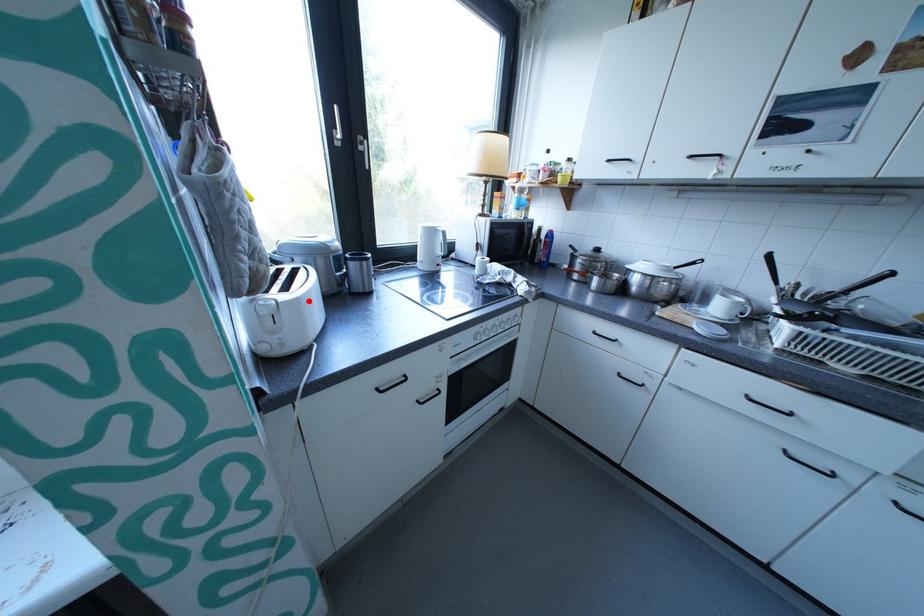
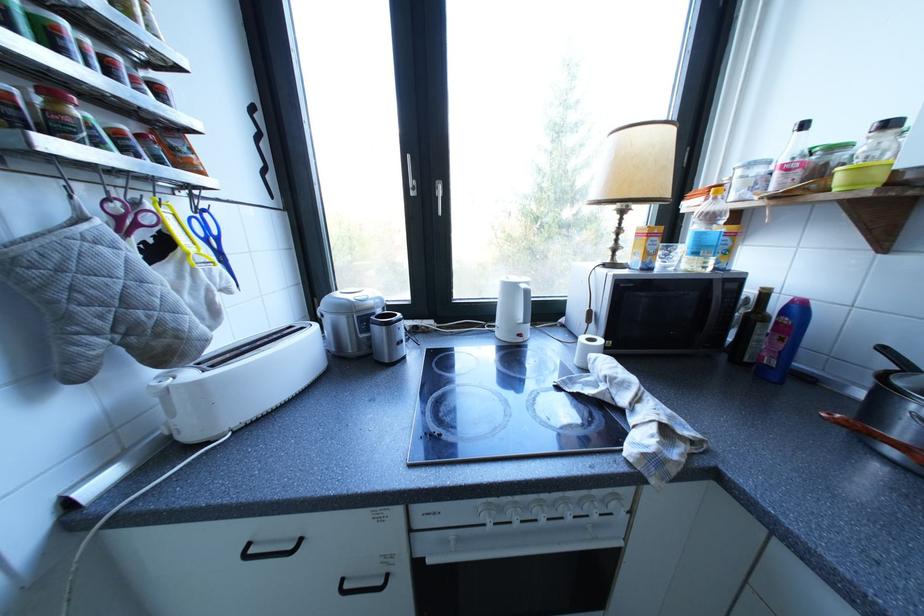
Question: I am providing you with two images of the same scene from different viewpoints. Given a red point in image1, look at the same physical point in image2. Is it:

Choices:
 (A) Closer to the viewpoint
 (B) Farther from the viewpoint

Answer: (B)